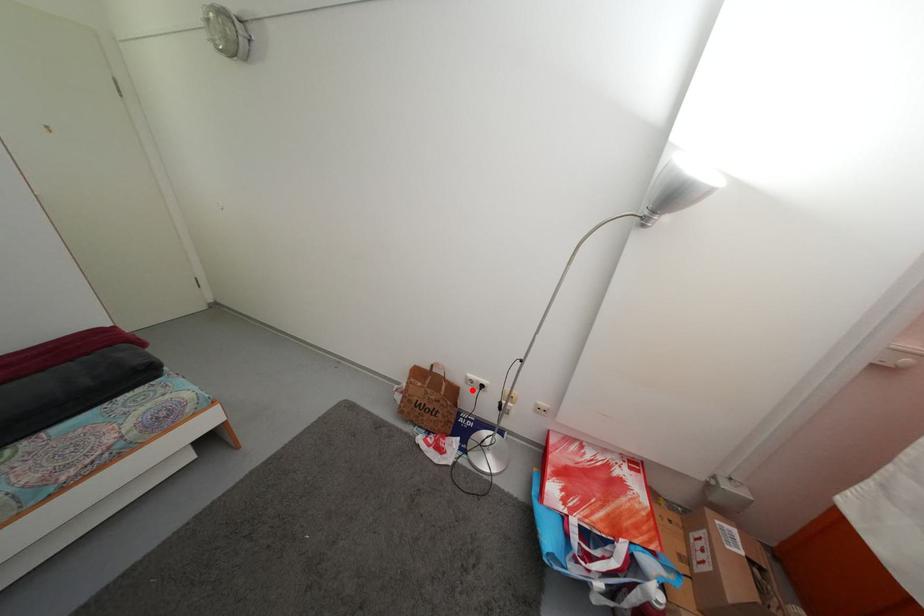
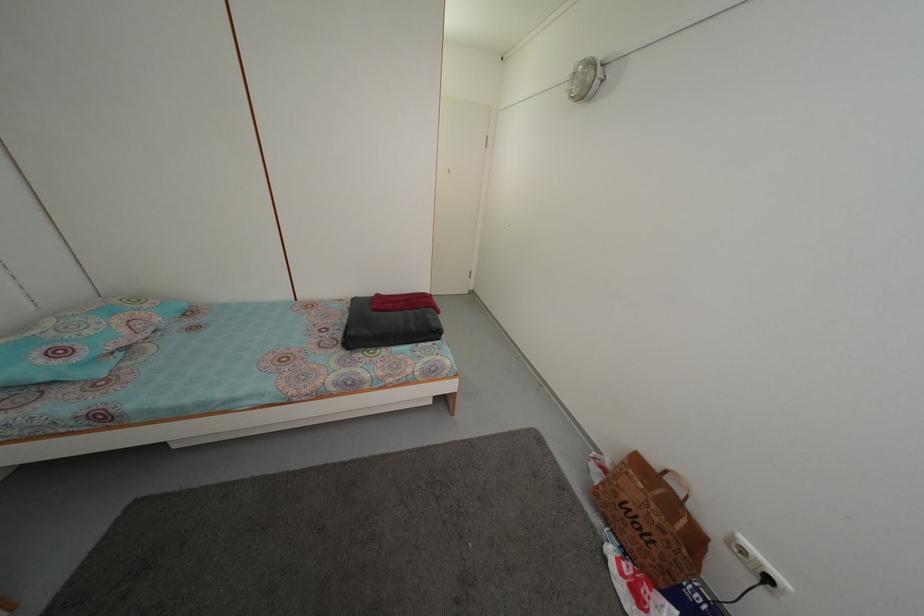
Question: I am providing you with two images of the same scene from different viewpoints. A red point is shown in image1. For the corresponding object point in image2, is it positioned nearer or farther from the camera?

Choices:
 (A) Nearer
 (B) Farther

Answer: (A)